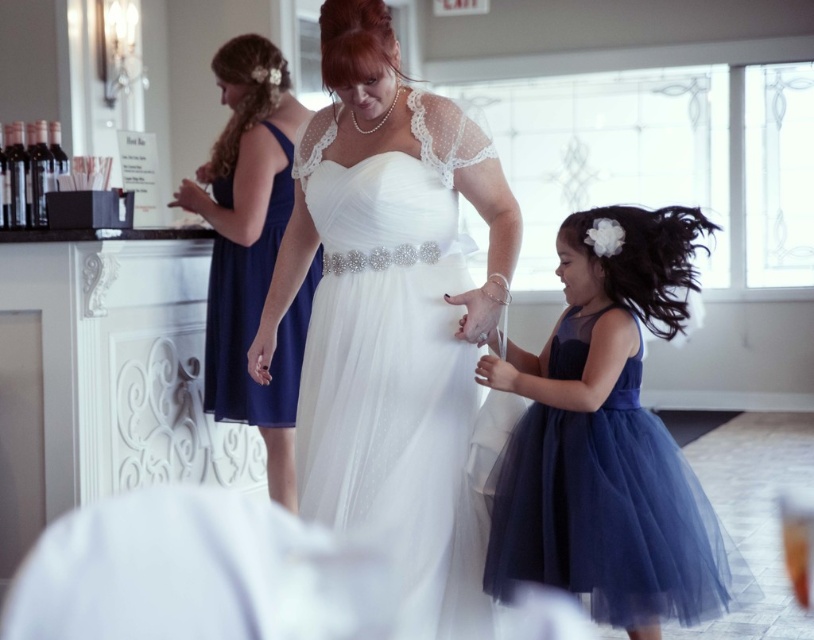
You are a photographer at the wedding venue and need to decide which dress to place in the foreground for a closeup shot. The camera is positioned to focus on the larger dress. Which dress should you choose between the navy tulle dress at lower right and the navy satin dress at upper left?

The navy tulle dress at lower right is bigger than the navy satin dress at upper left, so you should choose the navy tulle dress at lower right for the closeup shot since it is larger and will fill the frame better.

You are a photographer at the wedding venue. You need to position a spotlight on the satin white gown at center and the navy tulle dress at lower right. According to their positions, which one should you light first if you want to follow the left to right order?

The satin white gown at center should be lit first because it is positioned to the left of the navy tulle dress at lower right, following the left to right order.

Looking at this image, you are a photographer at the wedding venue and need to position the satin white gown at center and the white lace dress at center for a group photo. Given their sizes, which one should you place closer to the camera to ensure both are fully visible in the frame?

The satin white gown at center is bigger than the white lace dress at center, so you should place the satin white gown at center closer to the camera to ensure its full size is captured while still fitting the smaller white lace dress at center in the frame.